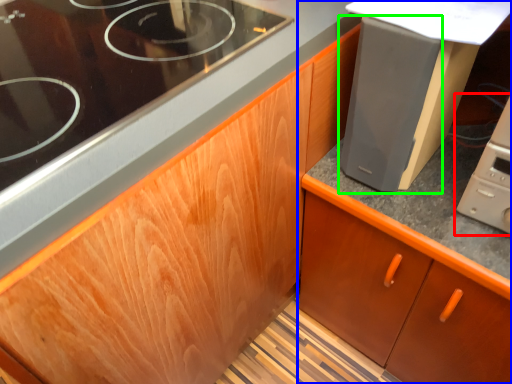
Question: Which object is the closest to the home appliance (highlighted by a red box)? Choose among these: cabinetry (highlighted by a blue box) or appliance (highlighted by a green box).

Choices:
 (A) cabinetry
 (B) appliance

Answer: (B)